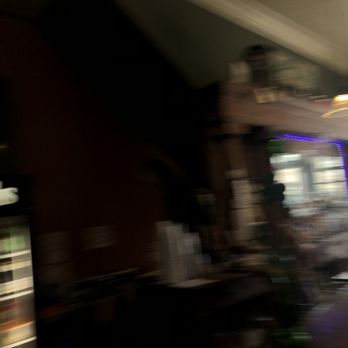
Where is `wall`? wall is located at coordinates (192, 50).